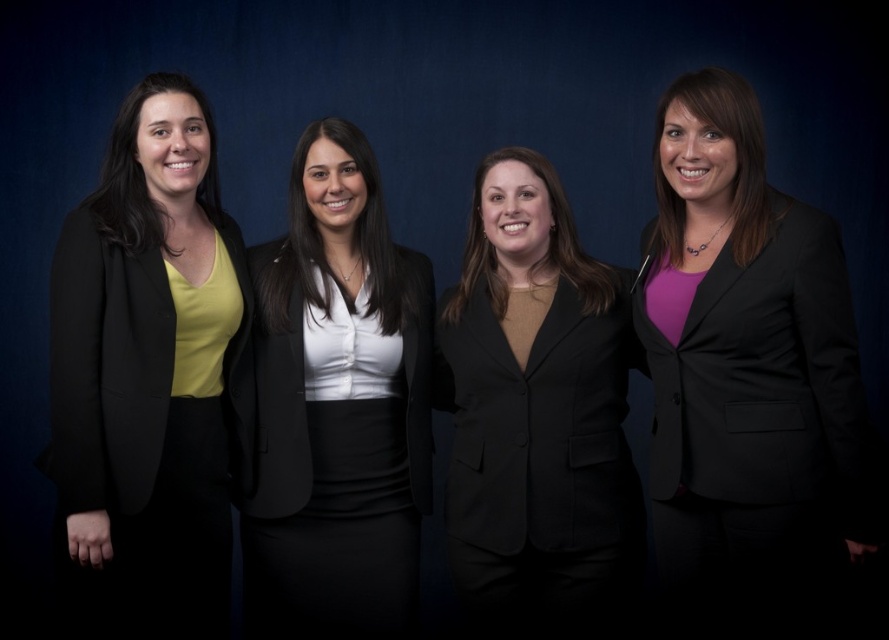
Question: Which of the following is the farthest from the observer?

Choices:
 (A) black matte blazer at center
 (B) matte black blazer at left

Answer: (A)

Question: Is matte black blazer at left positioned before matte black blazer at center?

Choices:
 (A) no
 (B) yes

Answer: (B)

Question: Which of these objects is positioned closest to the matte black blazer at left?

Choices:
 (A) matte black blazer at center
 (B) black matte blazer at center

Answer: (A)

Question: Is matte black blazer at left closer to the viewer compared to matte black blazer at center?

Choices:
 (A) yes
 (B) no

Answer: (A)

Question: Which object is closer to the camera taking this photo?

Choices:
 (A) matte black blazer at left
 (B) purple matte blazer at right
 (C) matte black blazer at center

Answer: (B)

Question: Is purple matte blazer at right bigger than black matte blazer at center?

Choices:
 (A) yes
 (B) no

Answer: (B)